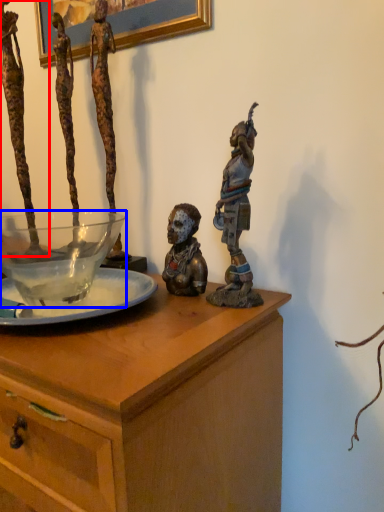
Question: Which object appears farthest to the camera in this image, person (highlighted by a red box) or glass bowl (highlighted by a blue box)?

Choices:
 (A) person
 (B) glass bowl

Answer: (A)